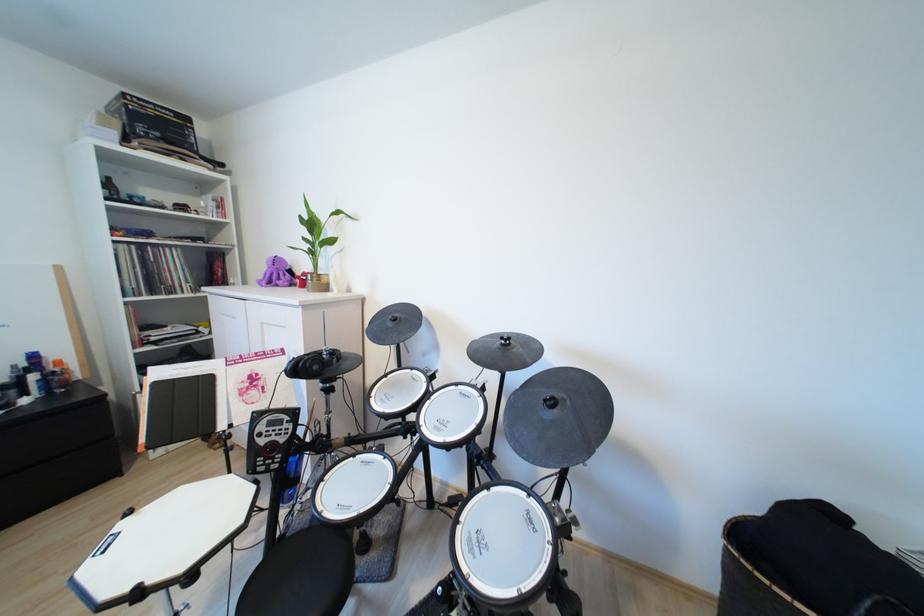
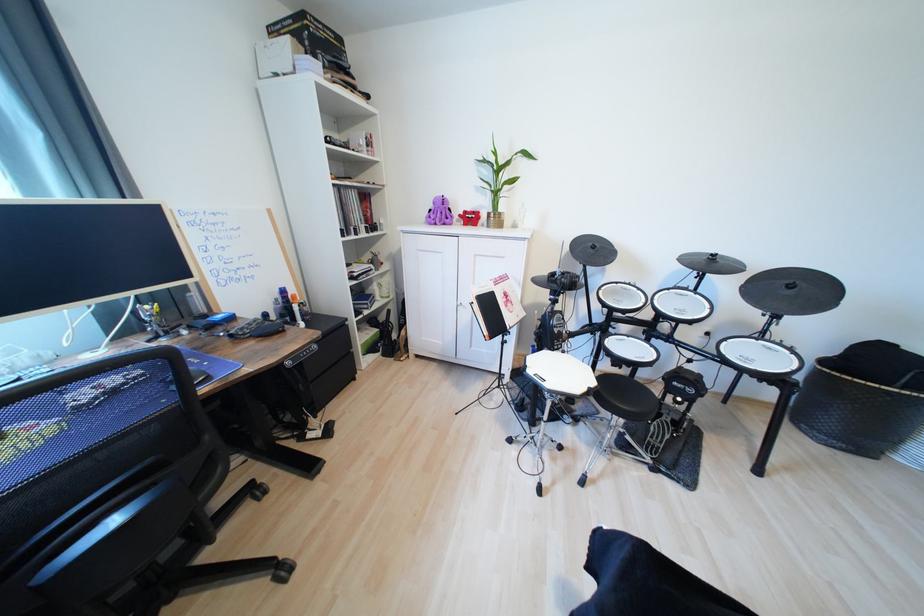
Find the pixel in the second image that matches [310,275] in the first image.

(472, 214)